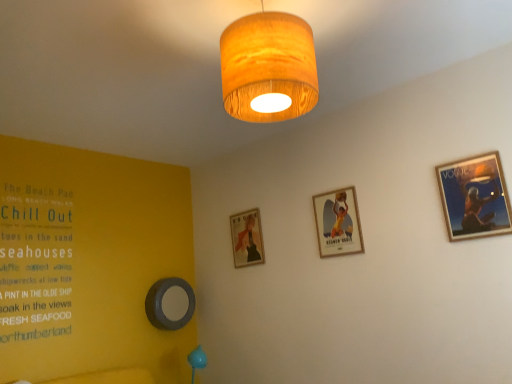
Question: Considering the positions of wooden framed poster at upper right, positioned as the first picture frame in right-to-left order, and wooden framed poster at center, placed as the third picture frame when sorted from left to right, in the image, is wooden framed poster at upper right, positioned as the first picture frame in right-to-left order, bigger or smaller than wooden framed poster at center, placed as the third picture frame when sorted from left to right,?

Choices:
 (A) big
 (B) small

Answer: (B)

Question: From a real-world perspective, is wooden framed poster at upper right, the fourth picture frame when ordered from back to front, positioned above or below wooden framed poster at center, the 2th picture frame positioned from the front?

Choices:
 (A) below
 (B) above

Answer: (A)

Question: Which object is the closest to the wooden drum lampshade at upper center?

Choices:
 (A) metallic gray circle at lower left, the first picture frame when ordered from left to right
 (B) wooden framed poster at center, placed as the third picture frame when sorted from left to right
 (C) matte gold picture frame at center, which is the third picture frame from right to left
 (D) wooden framed poster at upper right, which is the fourth picture frame in left-to-right order

Answer: (D)

Question: Estimate the real-world distances between objects in this image. Which object is farther from the metallic gray circle at lower left, marked as the 4th picture frame in a front-to-back arrangement?

Choices:
 (A) wooden framed poster at upper right, positioned as the first picture frame in right-to-left order
 (B) matte gold picture frame at center, the second picture frame from the left
 (C) wooden drum lampshade at upper center
 (D) wooden framed poster at center, placed as the second picture frame when sorted from right to left

Answer: (A)